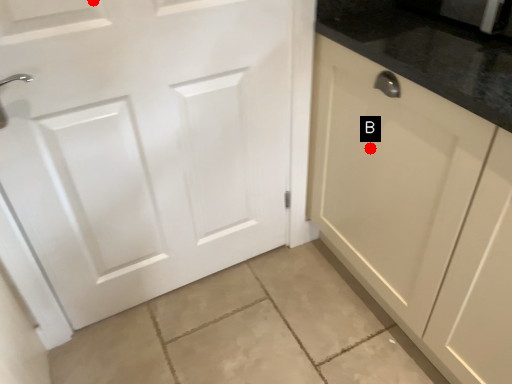
Question: Two points are circled on the image, labeled by A and B beside each circle. Which of the following is the farthest from the observer?

Choices:
 (A) A is further
 (B) B is further

Answer: (B)